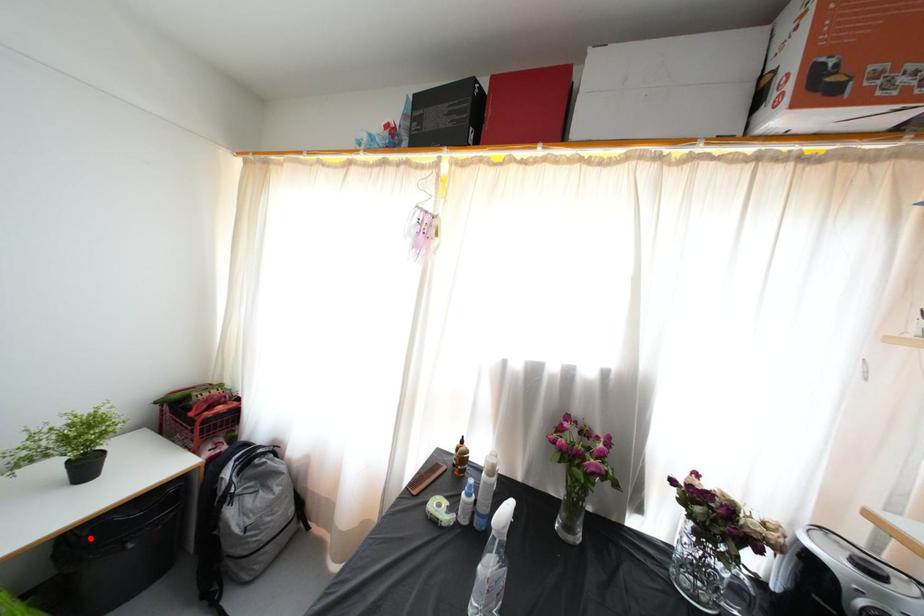
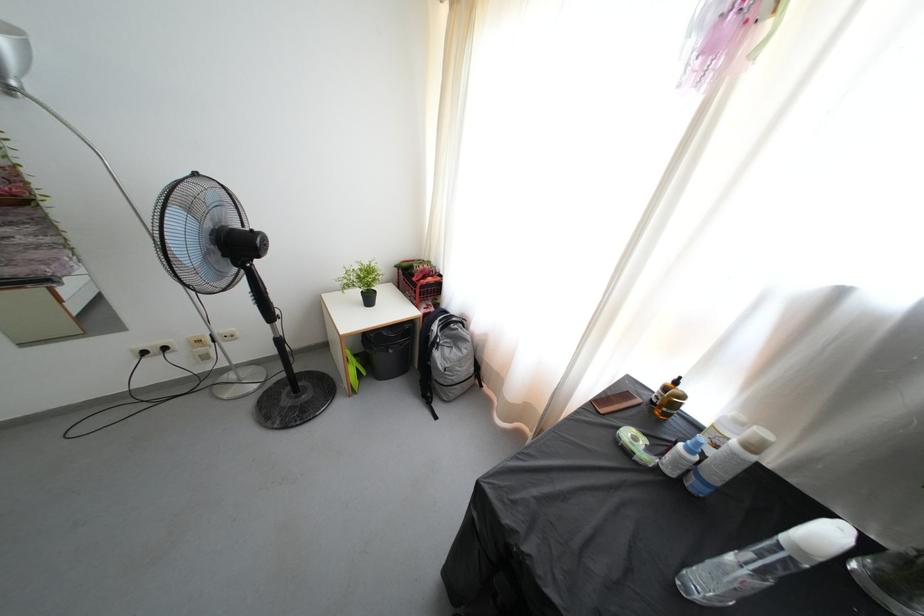
Question: I am providing you with two images of the same scene from different viewpoints. Image1 has a red point marked. In image2, the corresponding 3D location appears at what relative position? Reply with the corresponding letter.

Choices:
 (A) Closer
 (B) Farther

Answer: (B)